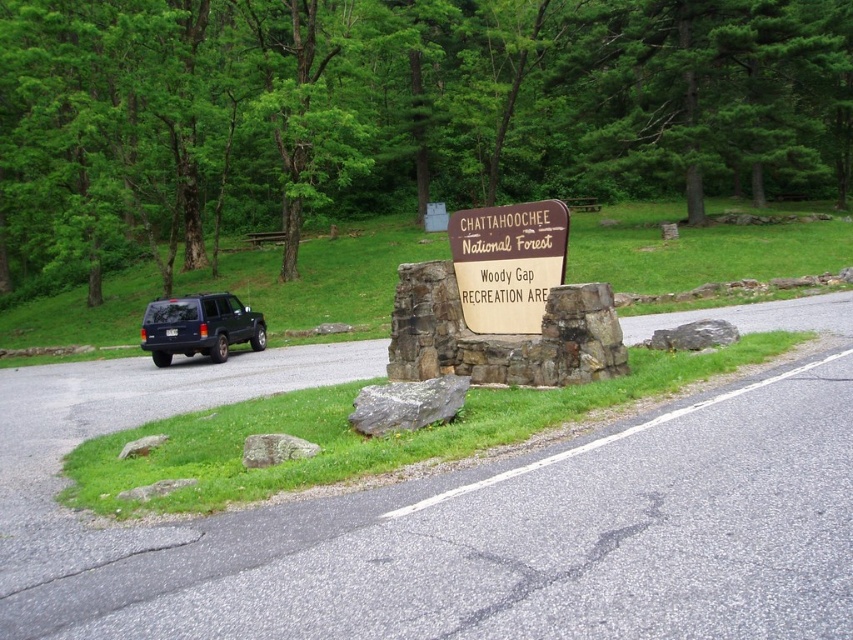
Question: Which object is farther from the camera taking this photo?

Choices:
 (A) matte blue suv at left
 (B) gray rock at lower left
 (C) gray rough rock at center
 (D) gray rock at lower right

Answer: (A)

Question: Can you confirm if gray rough rock at center is bigger than gray rough rock at lower left?

Choices:
 (A) yes
 (B) no

Answer: (A)

Question: Can you confirm if gray rock at lower center is thinner than gray rough rock at lower left?

Choices:
 (A) yes
 (B) no

Answer: (B)

Question: Which of the following is the closest to the observer?

Choices:
 (A) (247, 460)
 (B) (534, 292)

Answer: (A)

Question: Which point is closer to the camera?

Choices:
 (A) (224, 336)
 (B) (138, 500)

Answer: (B)

Question: Can you confirm if matte blue suv at left is thinner than gray rock at lower left?

Choices:
 (A) yes
 (B) no

Answer: (B)